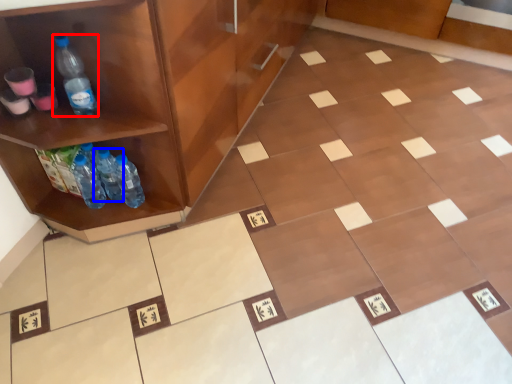
Question: Which object is further to the camera taking this photo, bottle (highlighted by a red box) or bottle (highlighted by a blue box)?

Choices:
 (A) bottle
 (B) bottle

Answer: (B)